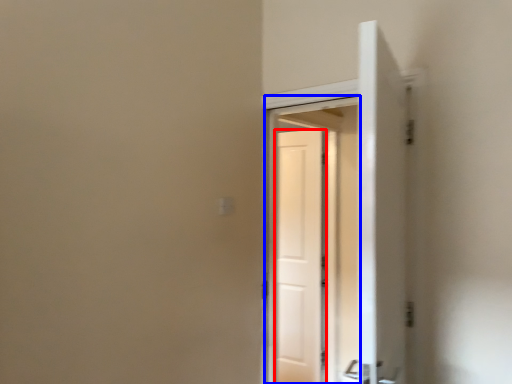
Question: Which object appears closest to the camera in this image, door (highlighted by a red box) or screen door (highlighted by a blue box)?

Choices:
 (A) door
 (B) screen door

Answer: (B)